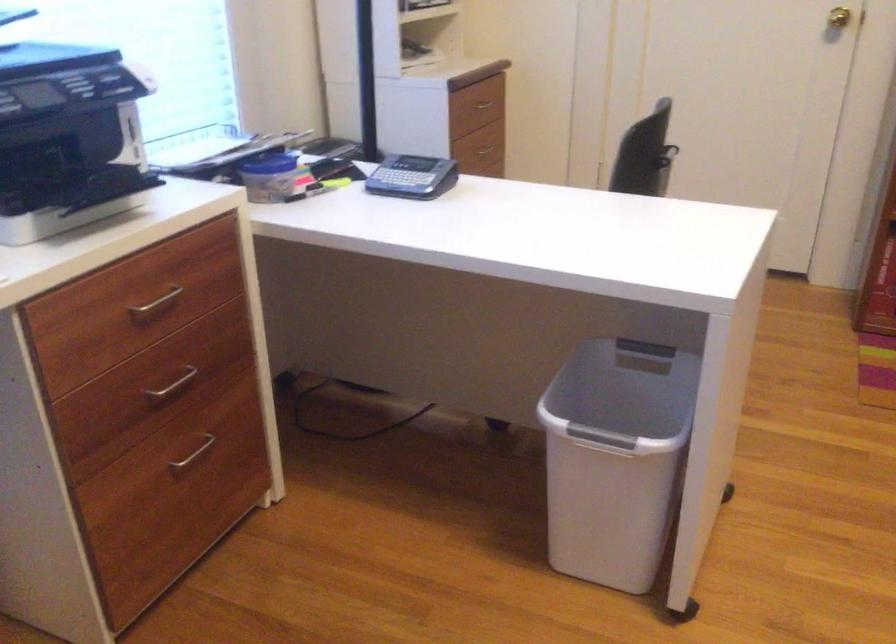
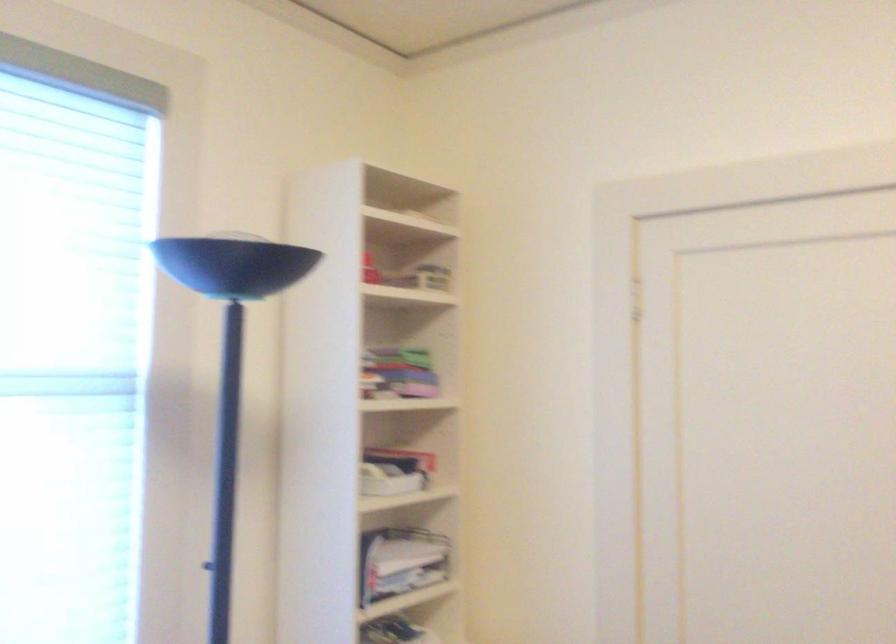
Question: The first image is from the beginning of the video and the second image is from the end. How did the camera likely rotate when shooting the video?

Choices:
 (A) Left
 (B) Right
 (C) Up
 (D) Down

Answer: (C)